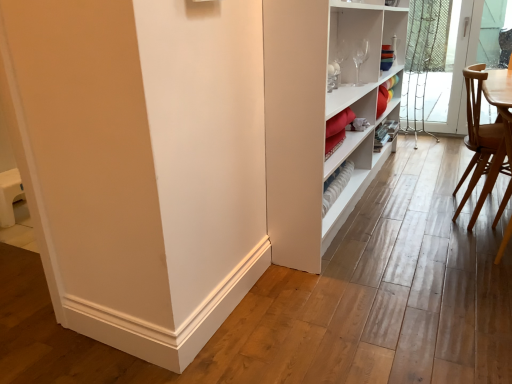
Question: From a real-world perspective, is light brown wooden chair at right positioned above or below clear glass screen door at right?

Choices:
 (A) below
 (B) above

Answer: (A)

Question: In terms of size, does light brown wooden chair at right appear bigger or smaller than clear glass screen door at right?

Choices:
 (A) big
 (B) small

Answer: (A)

Question: In the image, is light brown wooden chair at right positioned in front of or behind clear glass screen door at right?

Choices:
 (A) behind
 (B) front

Answer: (B)

Question: Looking at the image, does clear glass screen door at right seem bigger or smaller compared to light brown wooden chair at right?

Choices:
 (A) small
 (B) big

Answer: (A)

Question: In the image, is clear glass screen door at right positioned in front of or behind light brown wooden chair at right?

Choices:
 (A) behind
 (B) front

Answer: (A)

Question: From the image's perspective, is clear glass screen door at right located above or below light brown wooden chair at right?

Choices:
 (A) above
 (B) below

Answer: (A)

Question: Is clear glass screen door at right inside or outside of light brown wooden chair at right?

Choices:
 (A) outside
 (B) inside

Answer: (A)